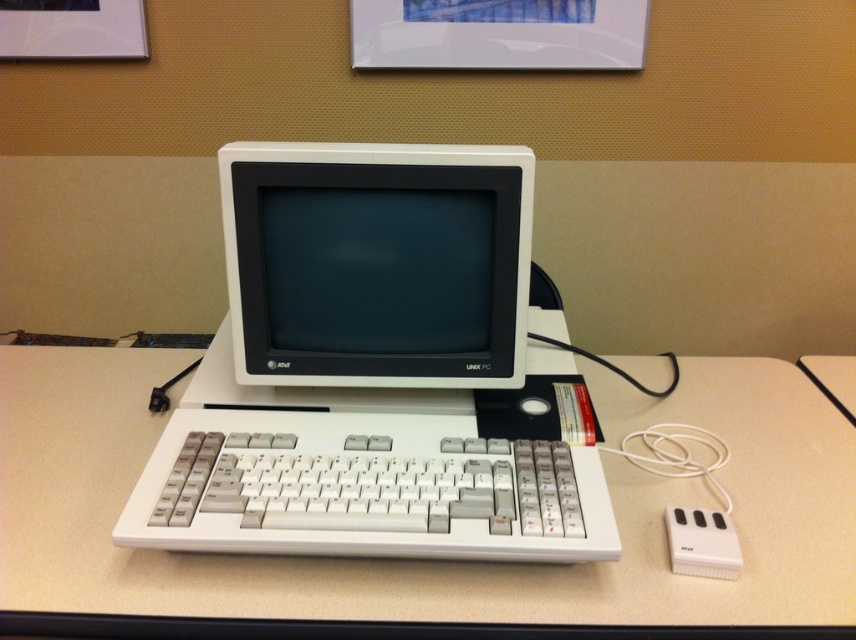
You are organizing the desk and need to place a new monitor on the white plastic computer desk at center. However, the current white plastic keyboard at center is blocking the space. Based on their positions, can you move the keyboard to the back of the desk without moving the desk itself?

The white plastic computer desk at center is in front of the white plastic keyboard at center, meaning the keyboard is already positioned at the back of the desk. Therefore, you cannot move it further back without moving the desk itself.

You are standing at the point marked as point (259, 406) and want to take a photo of the vintage computer setup on the desk. The camera you have can focus on objects within 35 inches. Will the camera be able to focus on the computer setup?

The distance between point (259, 406) and the camera is 37.27 inches, which is beyond the camera focus range of 35 inches. Therefore, the camera will not be able to focus on the computer setup.

In the scene shown: You are organizing a desk and need to place a new item between the white plastic monitor at center and the white plastic keyboard at center. According to their positions, which side of the keyboard should you place the new item?

The white plastic monitor at center is to the right of the white plastic keyboard at center, so you should place the new item to the right side of the keyboard to align with the monitor.